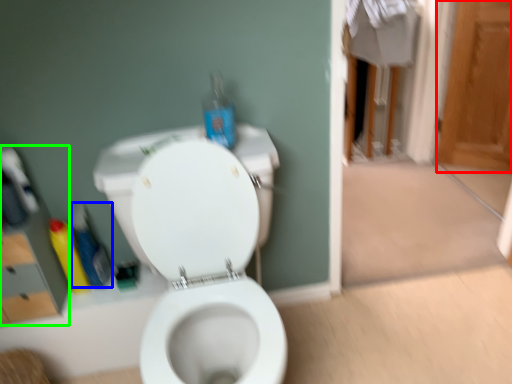
Question: Considering the real-world distances, which object is closest to screen door (highlighted by a red box)? cleaning product (highlighted by a blue box) or medicine cabinet (highlighted by a green box).

Choices:
 (A) cleaning product
 (B) medicine cabinet

Answer: (A)